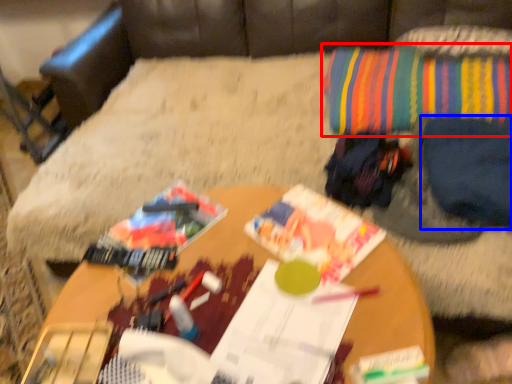
Question: Which point is further to the camera, throw pillow (highlighted by a red box) or clothing (highlighted by a blue box)?

Choices:
 (A) throw pillow
 (B) clothing

Answer: (A)